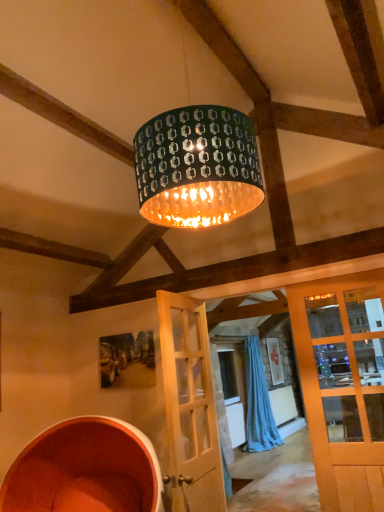
Question: From the image's perspective, would you say green metallic drum at center is shown under light wood door at center?

Choices:
 (A) yes
 (B) no

Answer: (B)

Question: Is green metallic drum at center bigger than light wood door at center?

Choices:
 (A) yes
 (B) no

Answer: (A)

Question: Can you confirm if green metallic drum at center is taller than light wood door at center?

Choices:
 (A) yes
 (B) no

Answer: (B)

Question: Is green metallic drum at center facing away from light wood door at center?

Choices:
 (A) no
 (B) yes

Answer: (A)

Question: Can you confirm if green metallic drum at center is smaller than light wood door at center?

Choices:
 (A) no
 (B) yes

Answer: (A)

Question: Based on their positions, is light wood door at center located to the left or right of green metallic drum at center?

Choices:
 (A) left
 (B) right

Answer: (B)

Question: Does point (185, 502) appear closer or farther from the camera than point (153, 168)?

Choices:
 (A) farther
 (B) closer

Answer: (A)

Question: In the image, is light wood door at center positioned in front of or behind green metallic drum at center?

Choices:
 (A) behind
 (B) front

Answer: (A)

Question: Is light wood door at center inside the boundaries of green metallic drum at center, or outside?

Choices:
 (A) outside
 (B) inside

Answer: (A)

Question: Relative to light wood door at center, is green metallic drum at center in front or behind?

Choices:
 (A) behind
 (B) front

Answer: (B)

Question: From the image's perspective, is green metallic drum at center positioned above or below light wood door at center?

Choices:
 (A) below
 (B) above

Answer: (B)

Question: Is green metallic drum at center bigger or smaller than light wood door at center?

Choices:
 (A) big
 (B) small

Answer: (A)

Question: Is point (228, 117) closer or farther from the camera than point (167, 323)?

Choices:
 (A) closer
 (B) farther

Answer: (A)

Question: Is light wood door at center inside or outside of blue fabric curtain at center?

Choices:
 (A) inside
 (B) outside

Answer: (B)

Question: From a real-world perspective, is light wood door at center above or below blue fabric curtain at center?

Choices:
 (A) above
 (B) below

Answer: (A)